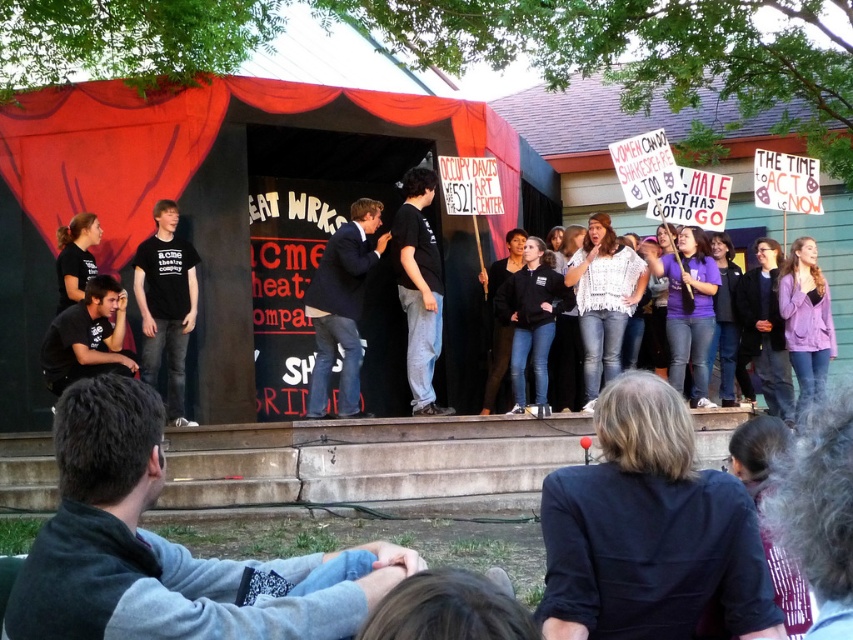
Question: Among these points, which one is nearest to the camera?

Choices:
 (A) (328, 282)
 (B) (404, 196)

Answer: (A)

Question: Which object is positioned closest to the black cotton shirt at center?

Choices:
 (A) dark blue suit at center
 (B) black cotton t-shirt at left

Answer: (A)

Question: Which of the following is the closest to the observer?

Choices:
 (A) black cotton shirt at center
 (B) dark blue suit at center

Answer: (B)

Question: Is black cotton t-shirt at left positioned before black cotton shirt at center?

Choices:
 (A) yes
 (B) no

Answer: (A)

Question: Can you confirm if dark blue suit at center is positioned below black cotton t-shirt at left?

Choices:
 (A) yes
 (B) no

Answer: (B)

Question: Does black cotton t-shirt at left have a larger size compared to black cotton shirt at center?

Choices:
 (A) yes
 (B) no

Answer: (B)